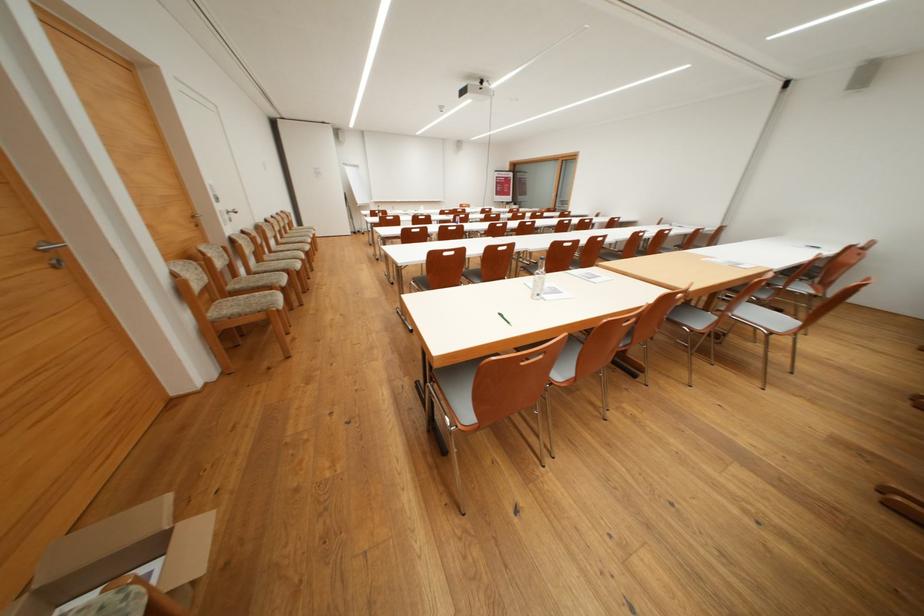
Which object does [538,280] point to?

It refers to a glass water bottle.